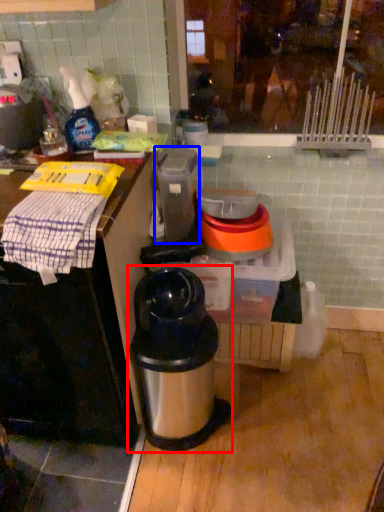
Question: Which point is further to the camera, waste container (highlighted by a red box) or appliance (highlighted by a blue box)?

Choices:
 (A) waste container
 (B) appliance

Answer: (B)